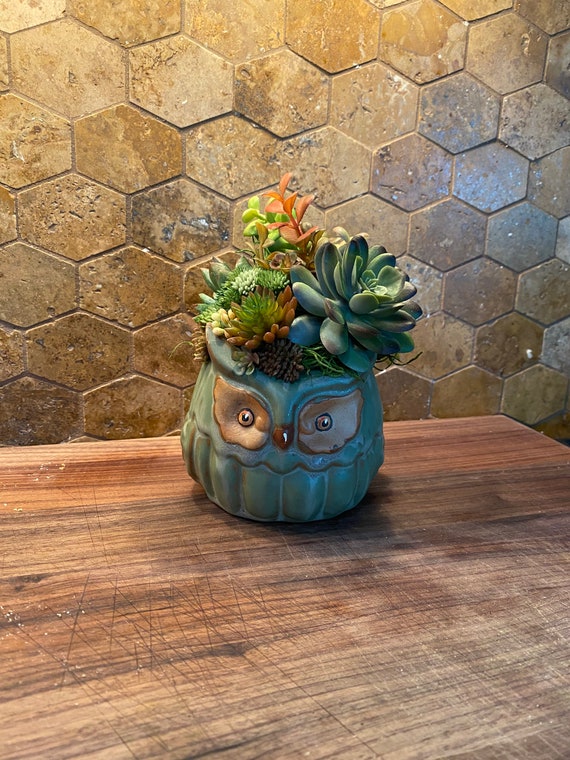
At what (x,y) coordinates should I click in order to perform the action: click on owl facedvase. Please return your answer as a coordinate pair (x, y). The width and height of the screenshot is (570, 760). Looking at the image, I should click on (293, 477).